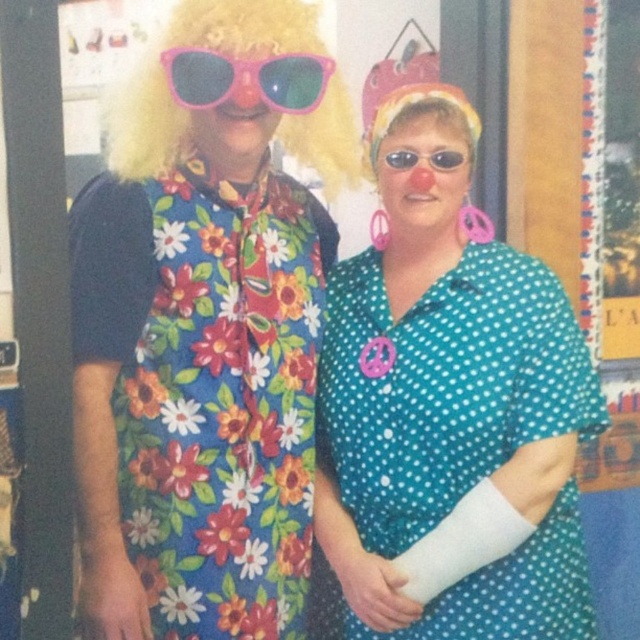
Does teal polka dot dress at center appear under pink plastic sunglasses at upper center?

Indeed, teal polka dot dress at center is positioned under pink plastic sunglasses at upper center.

Is teal polka dot dress at center to the left of pink plastic sunglasses at upper center from the viewer's perspective?

In fact, teal polka dot dress at center is to the right of pink plastic sunglasses at upper center.

Which is in front, point (536, 420) or point (307, 65)?

Point (307, 65)

Find the location of a particular element. This screenshot has height=640, width=640. teal polka dot dress at center is located at coordinates (444, 385).

Who is shorter, floral fabric dress at left or fluffy blonde wig at upper left?

fluffy blonde wig at upper left

Is floral fabric dress at left to the right of fluffy blonde wig at upper left from the viewer's perspective?

Incorrect, floral fabric dress at left is not on the right side of fluffy blonde wig at upper left.

Is point (268, 538) positioned after point (333, 134)?

No, it is in front of (333, 134).

Find the location of a particular element. floral fabric dress at left is located at coordinates (209, 387).

Between point (106, 116) and point (204, 56), which one is positioned behind?

Point (106, 116)

The height and width of the screenshot is (640, 640). Find the location of `fluffy blonde wig at upper left`. fluffy blonde wig at upper left is located at coordinates (195, 45).

Who is more forward, (x=115, y=131) or (x=220, y=76)?

Point (x=220, y=76) is more forward.

Locate an element on the screen. This screenshot has height=640, width=640. fluffy blonde wig at upper left is located at coordinates (195, 45).